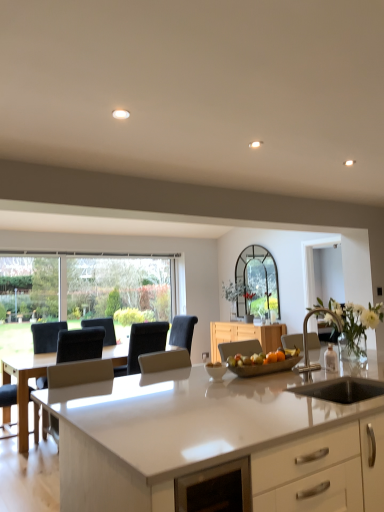
At what (x,y) coordinates should I click in order to perform the action: click on vacant space in front of metallic silver tray at center. Please return your answer as a coordinate pair (x, y). Looking at the image, I should click on (258, 385).